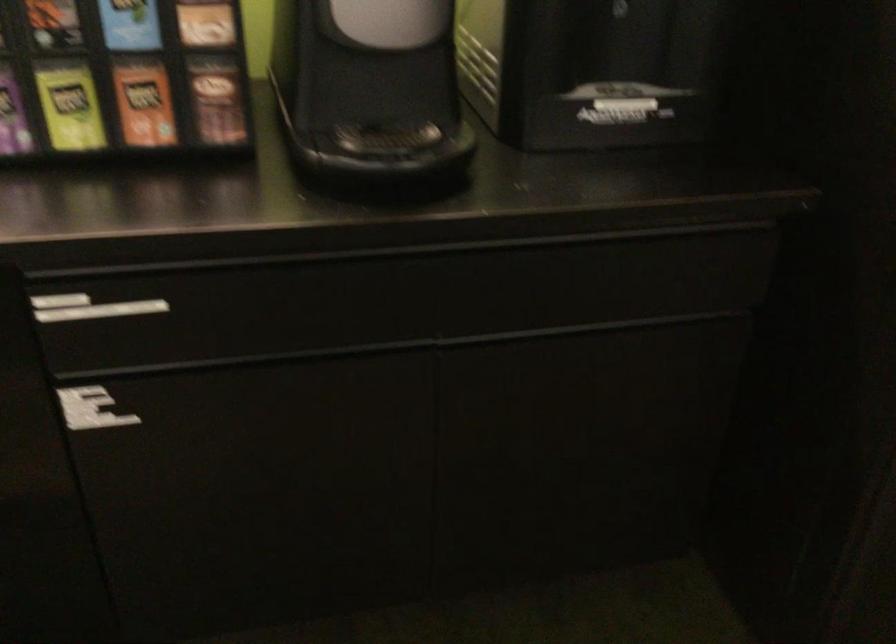
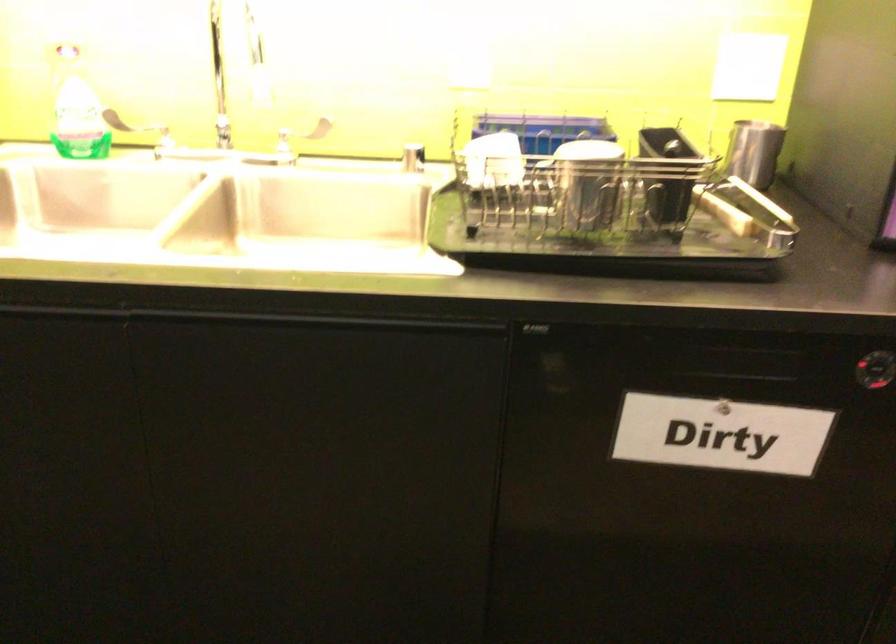
Question: The first image is from the beginning of the video and the second image is from the end. How did the camera likely rotate when shooting the video?

Choices:
 (A) Left
 (B) Right
 (C) Up
 (D) Down

Answer: (A)